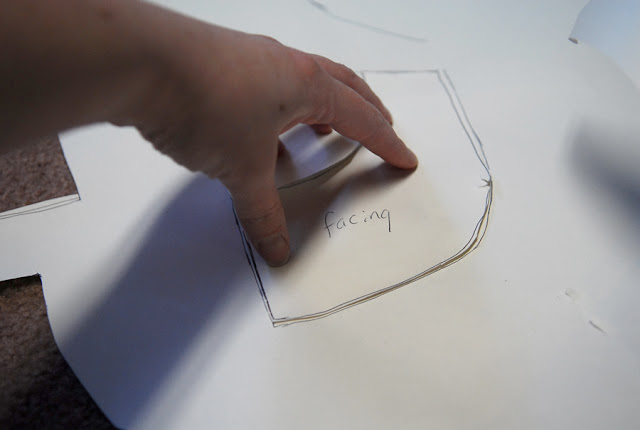
The image size is (640, 430). I want to click on carpet or flooring under the diagram, so click(x=18, y=347).